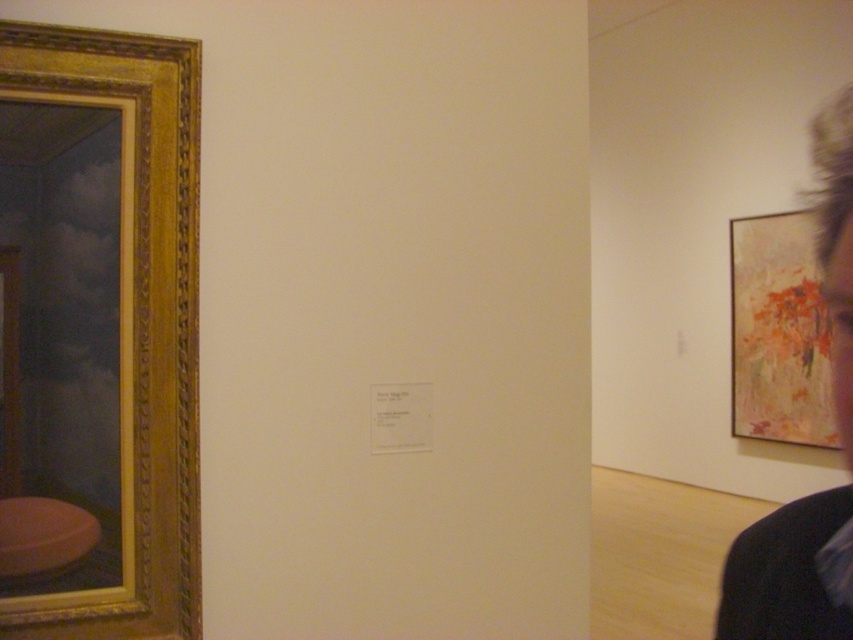
Question: Which point is farther to the camera?

Choices:
 (A) abstract painting at right
 (B) dark hair at upper right

Answer: (A)

Question: Does gold ornate frame at left appear on the right side of abstract painting at right?

Choices:
 (A) no
 (B) yes

Answer: (A)

Question: Which point is closer to the camera taking this photo?

Choices:
 (A) (160, 51)
 (B) (747, 275)
 (C) (838, 627)

Answer: (C)

Question: Does dark hair at upper right appear on the right side of abstract painting at right?

Choices:
 (A) no
 (B) yes

Answer: (A)

Question: Which point is farther from the camera taking this photo?

Choices:
 (A) (15, 60)
 (B) (840, 326)

Answer: (A)

Question: Is gold ornate frame at left smaller than abstract painting at right?

Choices:
 (A) no
 (B) yes

Answer: (B)